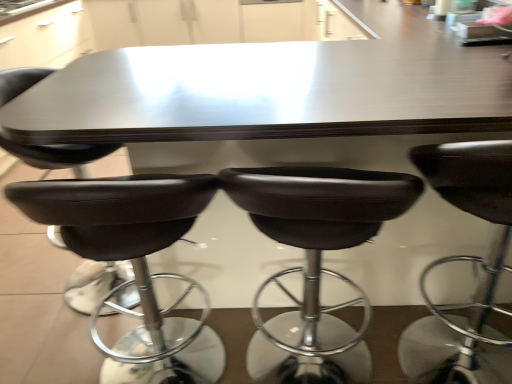
Question: Is the depth of black leather stool at center, the fifth chair when ordered from left to right, greater than that of black leather chair at lower left, marked as the fourth chair in a right-to-left arrangement?

Choices:
 (A) yes
 (B) no

Answer: (B)

Question: From the image's perspective, is black leather stool at center, the fifth chair when ordered from left to right, beneath black leather chair at lower left, marked as the fourth chair in a right-to-left arrangement?

Choices:
 (A) no
 (B) yes

Answer: (B)

Question: From the image's perspective, is black leather stool at center, the fifth chair when ordered from left to right, on top of black leather chair at lower left, marked as the fourth chair in a right-to-left arrangement?

Choices:
 (A) yes
 (B) no

Answer: (B)

Question: Is black leather stool at center, placed as the first chair when sorted from right to left, oriented towards black leather chair at lower left, the second chair when ordered from left to right?

Choices:
 (A) yes
 (B) no

Answer: (B)

Question: Considering the relative sizes of black leather stool at center, the fifth chair when ordered from left to right, and black leather chair at lower left, the second chair when ordered from left to right, in the image provided, is black leather stool at center, the fifth chair when ordered from left to right, thinner than black leather chair at lower left, the second chair when ordered from left to right,?

Choices:
 (A) no
 (B) yes

Answer: (A)

Question: Considering the relative positions of black leather stool at center, the fifth chair when ordered from left to right, and black leather chair at lower left, the second chair when ordered from left to right, in the image provided, is black leather stool at center, the fifth chair when ordered from left to right, to the right of black leather chair at lower left, the second chair when ordered from left to right, from the viewer's perspective?

Choices:
 (A) no
 (B) yes

Answer: (B)

Question: Is black leather chair at lower left, marked as the fourth chair in a right-to-left arrangement, located within black leather stool at center, which is the third chair from right to left?

Choices:
 (A) yes
 (B) no

Answer: (B)

Question: From the image's perspective, is black leather stool at center, the 3th chair positioned from the left, on top of black leather chair at lower left, the second chair when ordered from left to right?

Choices:
 (A) no
 (B) yes

Answer: (A)

Question: From a real-world perspective, is black leather stool at center, the 3th chair positioned from the left, physically above black leather chair at lower left, the second chair when ordered from left to right?

Choices:
 (A) yes
 (B) no

Answer: (B)

Question: Is black leather stool at center, which is the third chair from right to left, with black leather chair at lower left, the second chair when ordered from left to right?

Choices:
 (A) yes
 (B) no

Answer: (B)

Question: Is black leather stool at center, the 3th chair positioned from the left, at the right side of black leather chair at lower left, marked as the fourth chair in a right-to-left arrangement?

Choices:
 (A) yes
 (B) no

Answer: (A)

Question: From the image's perspective, does black leather stool at center, which is the third chair from right to left, appear lower than black leather chair at lower left, marked as the fourth chair in a right-to-left arrangement?

Choices:
 (A) no
 (B) yes

Answer: (B)

Question: From the image's perspective, is black leather chair at lower left, marked as the fourth chair in a right-to-left arrangement, below black leather stool at center, the fifth chair when ordered from left to right?

Choices:
 (A) yes
 (B) no

Answer: (B)